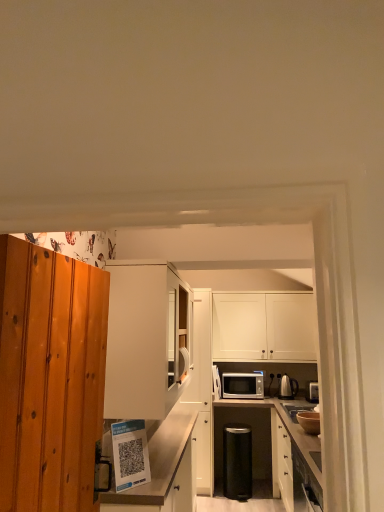
Question: Is matte white shelf at lower center, the 2th cabinetry positioned from the left, inside or outside of white matte cabinet at center, which is the 4th cabinetry in right-to-left order?

Choices:
 (A) inside
 (B) outside

Answer: (B)

Question: Relative to white matte cabinet at center, which is the 4th cabinetry in right-to-left order, is matte white shelf at lower center, which is the third cabinetry from right to left, in front or behind?

Choices:
 (A) behind
 (B) front

Answer: (B)

Question: Which is nearer to the matte white shelf at lower center, which is the third cabinetry from right to left?

Choices:
 (A) silver metallic microwave at center
 (B) white matte cabinet at center, which is the 4th cabinetry in right-to-left order
 (C) matte brown bowl at lower right, which is counted as the second appliance, starting from the right
 (D) black plastic trash can at center, placed as the 2th appliance when sorted from back to front
 (E) white matte cabinet at center, placed as the 2th cabinetry when sorted from right to left

Answer: (B)

Question: Based on their relative distances, which object is farther from the matte white shelf at lower center, which is the third cabinetry from right to left?

Choices:
 (A) black plastic trash can at center, placed as the 2th appliance when sorted from back to front
 (B) matte brown bowl at lower right, the first appliance viewed from the top
 (C) white matte cabinet at center, marked as the 3th cabinetry in a left-to-right arrangement
 (D) silver metallic microwave at center
 (E) white matte cabinet at center, placed as the first cabinetry when sorted from left to right

Answer: (D)